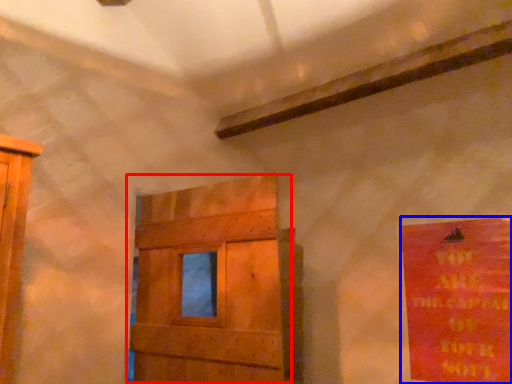
Question: Which object appears closest to the camera in this image, door (highlighted by a red box) or poster (highlighted by a blue box)?

Choices:
 (A) door
 (B) poster

Answer: (A)